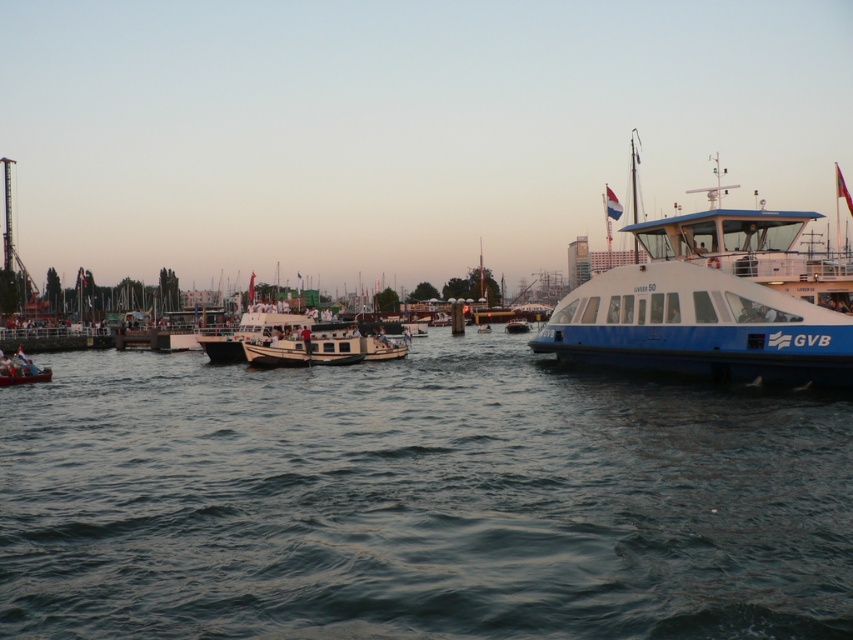
You are standing on the dock and see the dark blue water at center and the white glossy boat at center. Which one is closer to you?

The dark blue water at center is closer to you because it is in front of the white glossy boat at center.

What are the coordinates of the blue glossy ferry at right?

The blue glossy ferry at right is located at coordinates [712,304].